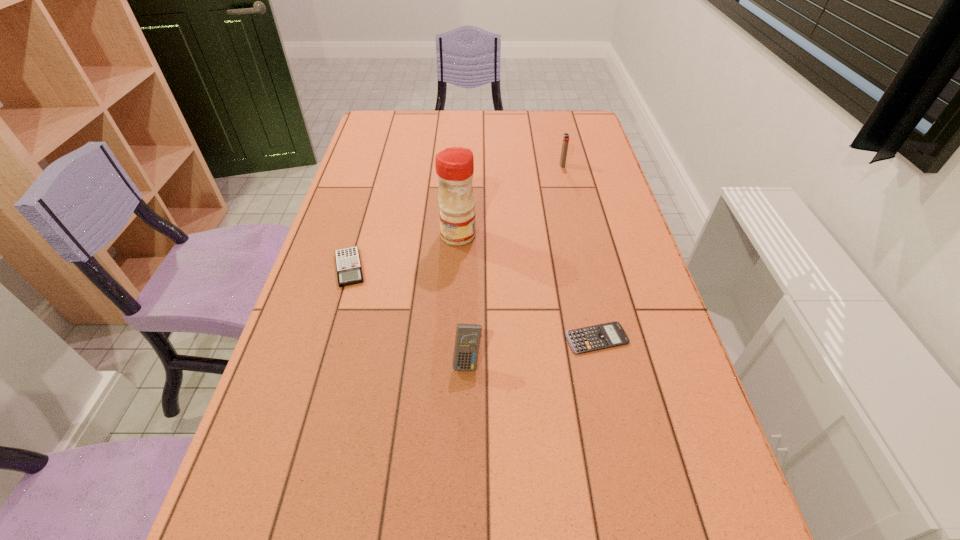
Image resolution: width=960 pixels, height=540 pixels. Find the location of `the second farthest object`. the second farthest object is located at coordinates (454, 166).

What are the coordinates of `the tallest object` in the screenshot? It's located at point(454,166).

Where is `the farthest object`? The image size is (960, 540). the farthest object is located at coordinates (565, 143).

At what (x,y) coordinates should I click in order to perform the action: click on the second calculator from right to left. Please return your answer as a coordinate pair (x, y). The height and width of the screenshot is (540, 960). Looking at the image, I should click on (467, 341).

Locate an element on the screen. This screenshot has width=960, height=540. the farthest calculator is located at coordinates (348, 264).

At what (x,y) coordinates should I click in order to perform the action: click on the leftmost calculator. Please return your answer as a coordinate pair (x, y). This screenshot has height=540, width=960. Looking at the image, I should click on coord(348,264).

In order to click on the shortest calculator in this screenshot , I will do `click(592, 338)`.

The height and width of the screenshot is (540, 960). I want to click on the rightmost calculator, so click(592, 338).

Find the location of a particular element. This screenshot has height=540, width=960. vacant space located 0.160m on the front of the condiment is located at coordinates (455, 291).

Find the location of a particular element. The width and height of the screenshot is (960, 540). free location located 0.060m on the right of the farthest object is located at coordinates (583, 165).